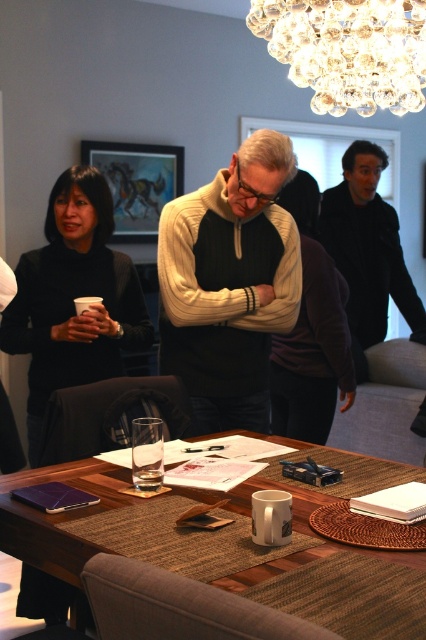
Is point (212, 499) positioned after point (367, 282)?

No, it is in front of (367, 282).

Locate an element on the screen. wooden table at center is located at coordinates (55, 516).

In the scene shown: Is clear crystal chandelier at upper center positioned before wooden table at center?

Result: That is False.

Does clear crystal chandelier at upper center have a greater height compared to wooden table at center?

Indeed, clear crystal chandelier at upper center has a greater height compared to wooden table at center.

Identify the location of clear crystal chandelier at upper center. (348, 51).

Locate an element on the screen. Image resolution: width=426 pixels, height=640 pixels. clear crystal chandelier at upper center is located at coordinates (348, 51).

Is white knit sweater at center to the right of wooden table at center from the viewer's perspective?

Indeed, white knit sweater at center is positioned on the right side of wooden table at center.

Who is positioned more to the right, white knit sweater at center or wooden table at center?

white knit sweater at center

Which is in front, point (178, 353) or point (111, 493)?

Point (111, 493) is in front.

Where is `white knit sweater at center`? white knit sweater at center is located at coordinates click(230, 284).